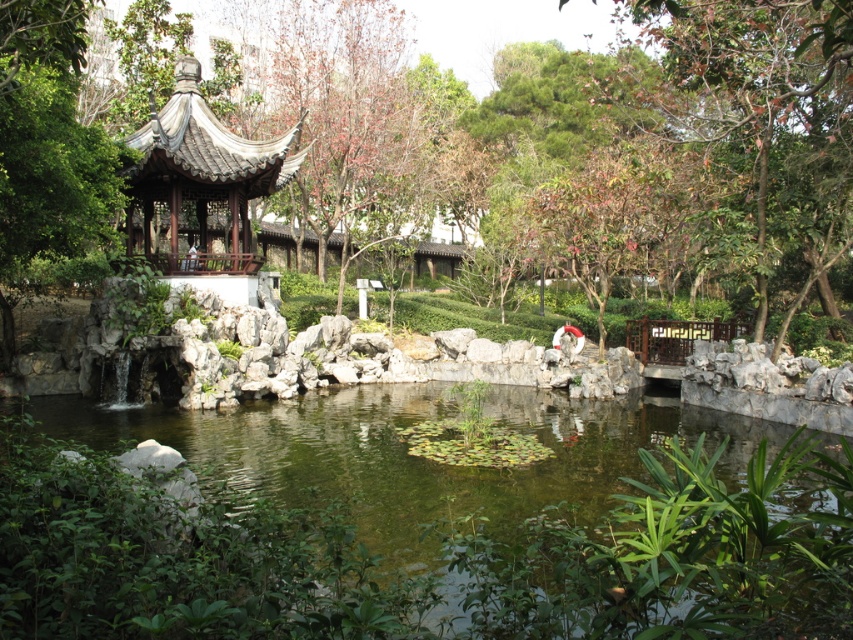
You are standing at the entrance of the garden and see the point marked at coordinates (422,554). What does this point indicate in the garden scene?

The point at coordinates (422,554) marks the green leafy pond at center.